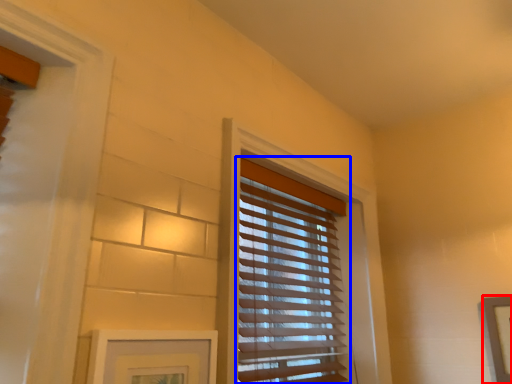
Question: Which object is closer to the camera taking this photo, picture frame (highlighted by a red box) or window blind (highlighted by a blue box)?

Choices:
 (A) picture frame
 (B) window blind

Answer: (B)